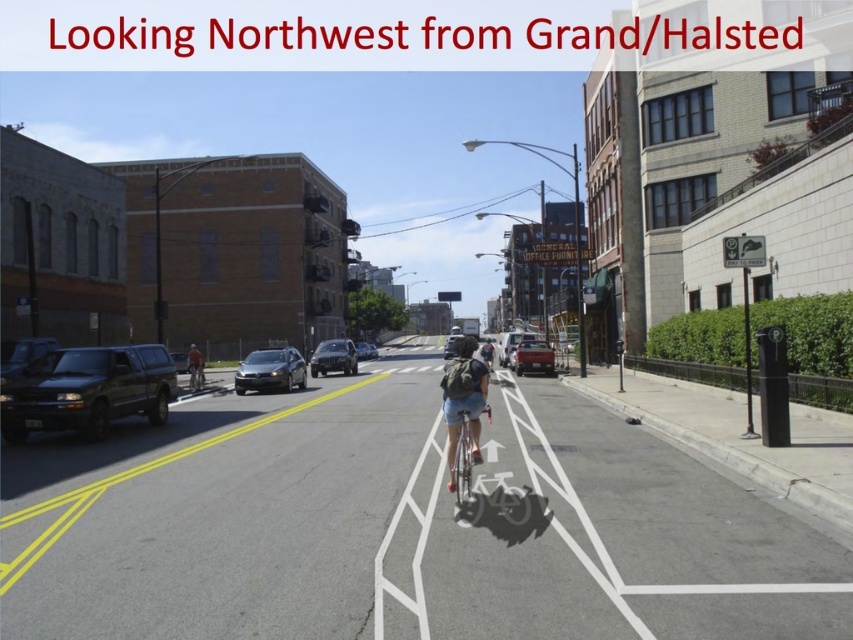
Question: Is metallic silver bicycle at center thinner than dark gray helmet at center?

Choices:
 (A) yes
 (B) no

Answer: (A)

Question: Among these points, which one is farthest from the camera?

Choices:
 (A) (534, 368)
 (B) (479, 406)
 (C) (337, 355)

Answer: (C)

Question: Which point is closer to the camera?

Choices:
 (A) dark gray helmet at center
 (B) satin silver suv at center

Answer: (A)

Question: Is satin silver sedan at center behind metallic silver bicycle at center?

Choices:
 (A) yes
 (B) no

Answer: (A)

Question: Does denim shorts at center have a greater width compared to matte red car at center?

Choices:
 (A) no
 (B) yes

Answer: (A)

Question: Which object is positioned closest to the orange fabric backpack at center?

Choices:
 (A) matte black suv at left
 (B) dark gray helmet at center
 (C) denim shorts at center

Answer: (A)